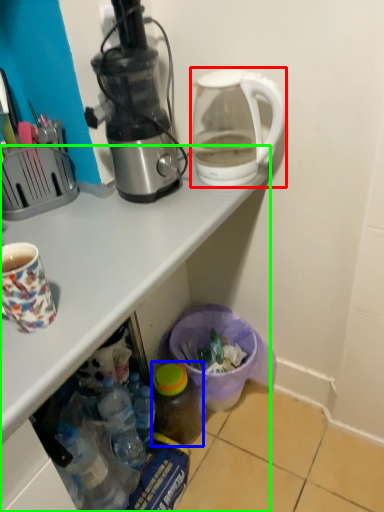
Question: Which object is the closest to the kettle (highlighted by a red box)? Choose among these: bottle (highlighted by a blue box) or desk (highlighted by a green box).

Choices:
 (A) bottle
 (B) desk

Answer: (B)